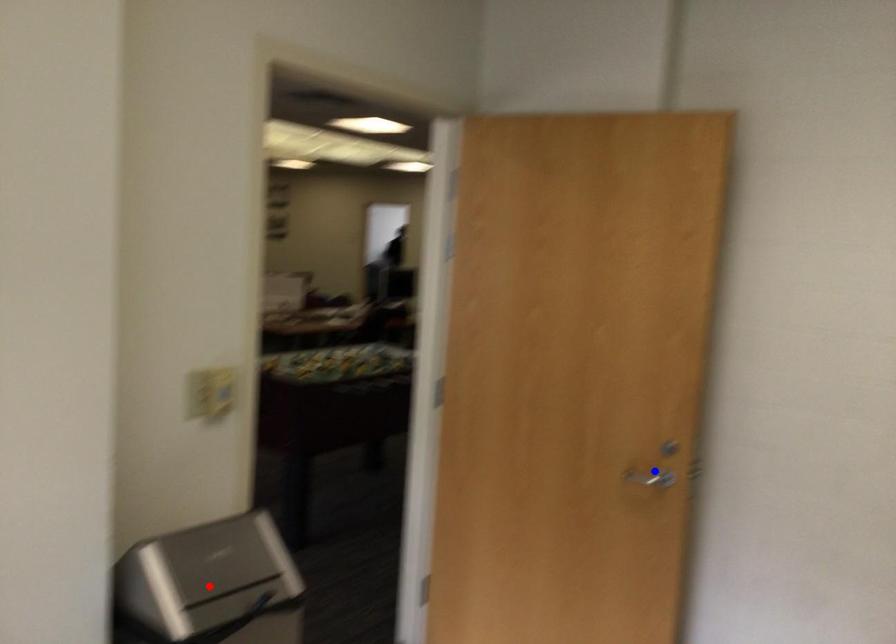
Question: Which of the two points in the image is closer to the camera?

Choices:
 (A) Blue point is closer.
 (B) Red point is closer.

Answer: (B)